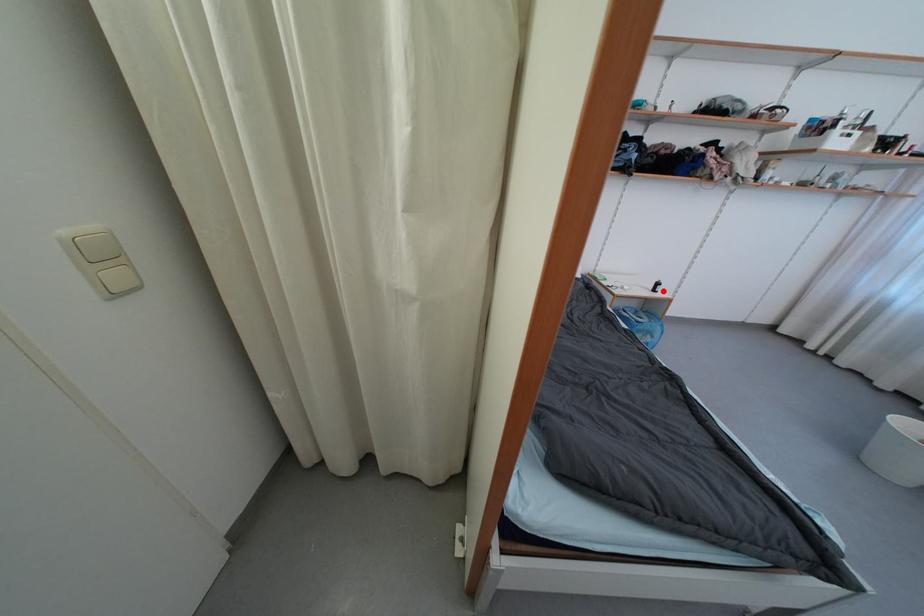
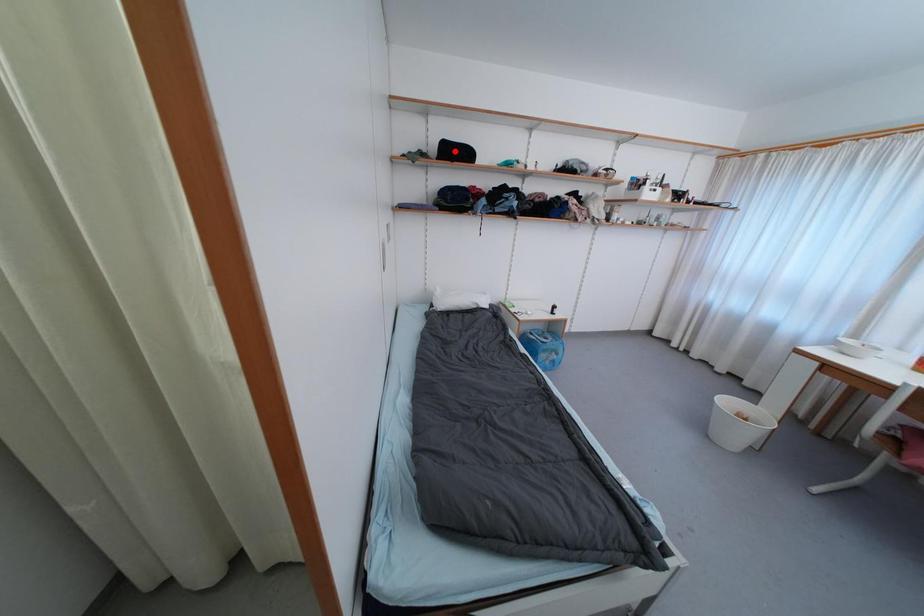
I am providing you with two images of the same scene from different viewpoints. A red point is marked on the first image and another point is marked on the second image. Does the point marked in image1 correspond to the same location as the one in image2?

No